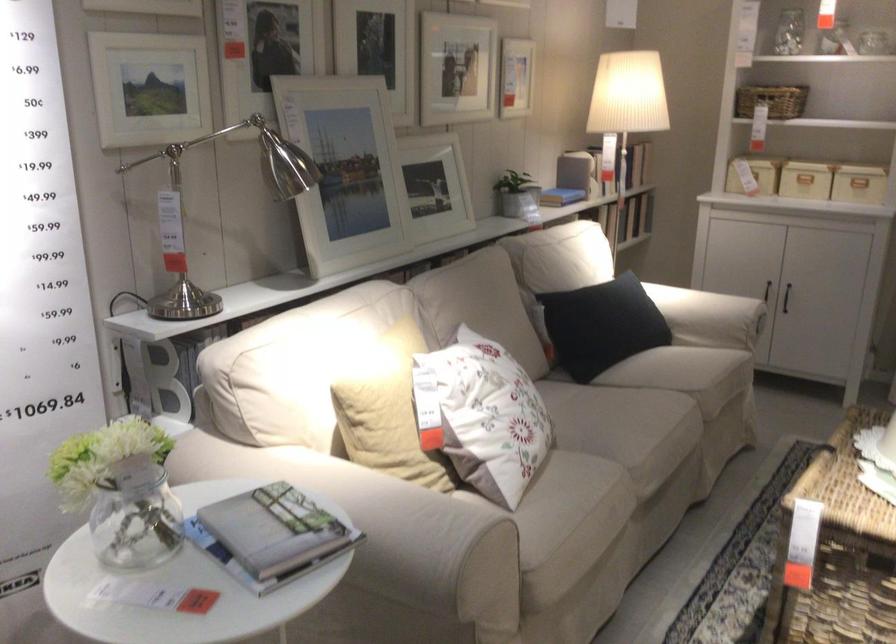
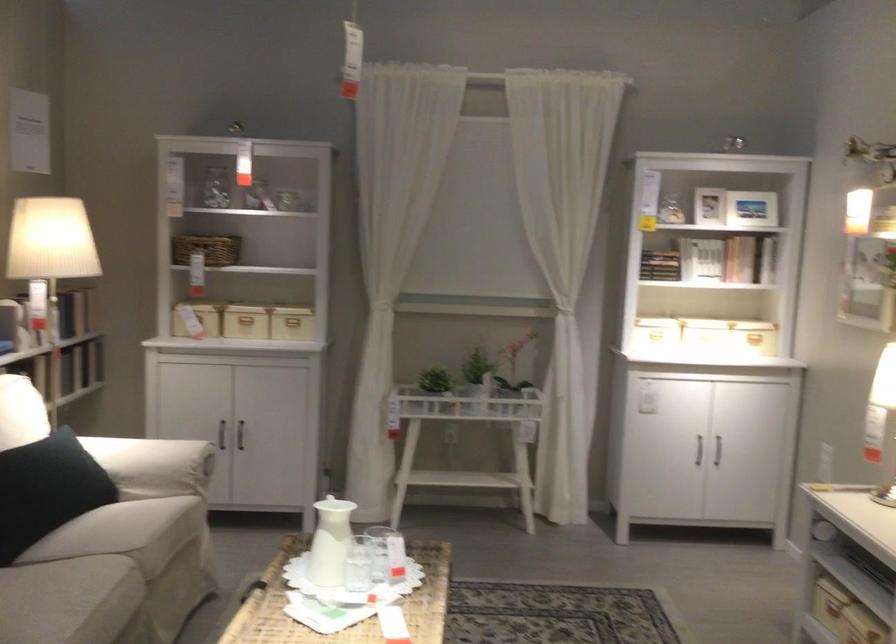
Locate, in the second image, the point that corresponds to point (770, 279) in the first image.

(221, 433)